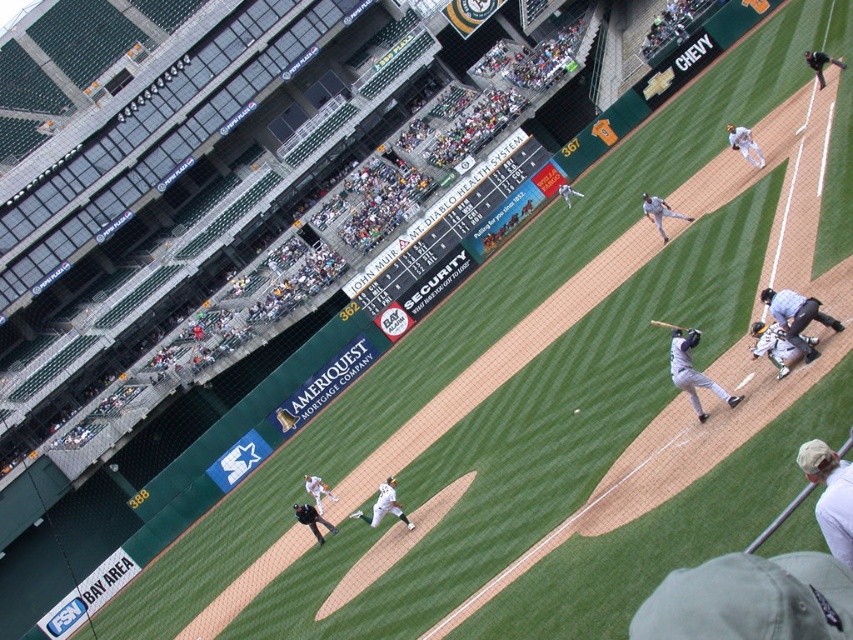
Question: Estimate the real-world distances between objects in this image. Which object is closer to the dark brown leather glove at lower right?

Choices:
 (A) gray matte uniform at center
 (B) wooden baseball bat at right
 (C) white uniformed pitcher at lower center

Answer: (A)

Question: Does white cloth cap at lower right appear on the right side of green fabric catcher at lower right?

Choices:
 (A) yes
 (B) no

Answer: (B)

Question: Estimate the real-world distances between objects in this image. Which object is closer to the dark brown leather glove at lower right?

Choices:
 (A) gray uniform umpire at right
 (B) gray uniformed pitcher at center

Answer: (A)

Question: From the image, what is the correct spatial relationship of white matte baseball glove at upper right in relation to gray uniformed pitcher at center?

Choices:
 (A) left
 (B) right

Answer: (B)

Question: Which point is farther to the camera?

Choices:
 (A) white matte baseball glove at upper right
 (B) white uniform pitcher at center
 (C) white uniformed pitcher at lower center
 (D) green fabric catcher at lower right

Answer: (A)

Question: Is gray matte uniform at center positioned before gray uniformed pitcher at center?

Choices:
 (A) yes
 (B) no

Answer: (A)